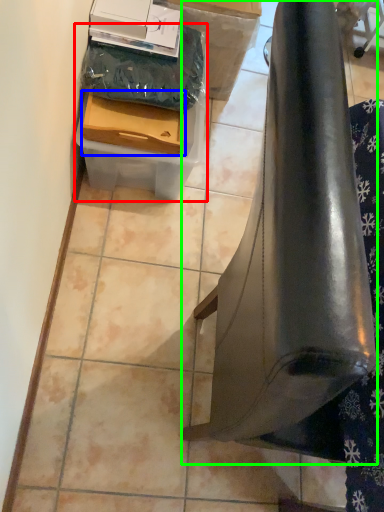
Question: Based on their relative distances, which object is farther from box (highlighted by a red box)? Choose from box (highlighted by a blue box) and furniture (highlighted by a green box).

Choices:
 (A) box
 (B) furniture

Answer: (B)